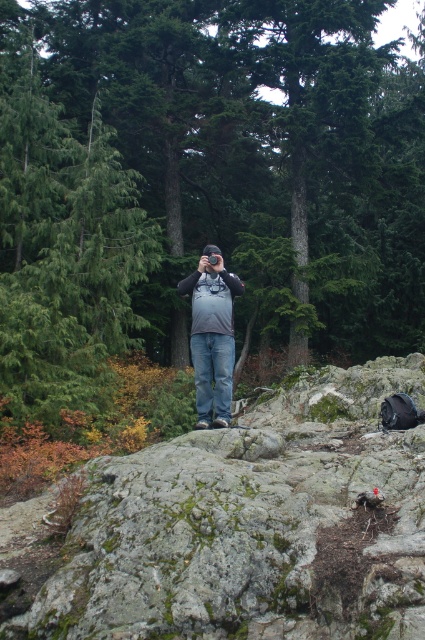
Can you confirm if green matte tree at center is positioned above matte gray backpack at center?

Correct, green matte tree at center is located above matte gray backpack at center.

Is green matte tree at center to the left of matte gray backpack at center from the viewer's perspective?

No, green matte tree at center is not to the left of matte gray backpack at center.

Between point (387, 180) and point (200, 298), which one is positioned behind?

The point (387, 180) is behind.

The image size is (425, 640). Find the location of `green matte tree at center`. green matte tree at center is located at coordinates (204, 180).

Is green matte tree at center thinner than mossy rock at center?

Incorrect, green matte tree at center's width is not less than mossy rock at center's.

Which of these two, green matte tree at center or mossy rock at center, stands shorter?

Standing shorter between the two is mossy rock at center.

Which is behind, point (192, 132) or point (391, 634)?

The point (192, 132) is behind.

Locate an element on the screen. green matte tree at center is located at coordinates (204, 180).

Does mossy rock at center have a lesser height compared to matte gray backpack at center?

Yes.

Does mossy rock at center appear over matte gray backpack at center?

No, mossy rock at center is not above matte gray backpack at center.

What do you see at coordinates (240, 525) in the screenshot? Image resolution: width=425 pixels, height=640 pixels. I see `mossy rock at center` at bounding box center [240, 525].

I want to click on mossy rock at center, so click(x=240, y=525).